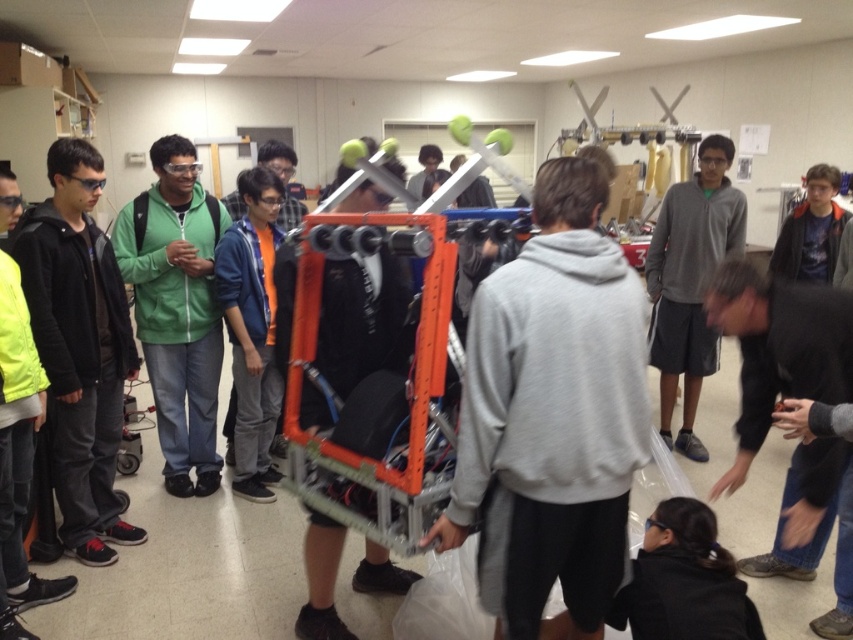
You are standing in the robotics workshop and see the black matte jacket at left hanging on a hook. If you want to reach it without moving your feet, can you do it?

The black matte jacket at left is 8.20 feet away from the viewer, which is too far to reach without moving your feet. You would need to step closer or use an object to retrieve it.

You are an observer standing in front of the robotic structure. Which item, the green matte jacket at left or the gray hoodie at center, is positioned closer to you?

The green matte jacket at left is closer to the viewer than the gray hoodie at center.

Based on the photo, you are a participant in the robotics event and need to identify clothing items for a team member. Which of the two items, the green matte jacket at left or the gray hoodie at center, is shorter in height?

The green matte jacket at left has a lesser height compared to the gray hoodie at center, so the green matte jacket at left is shorter in height.